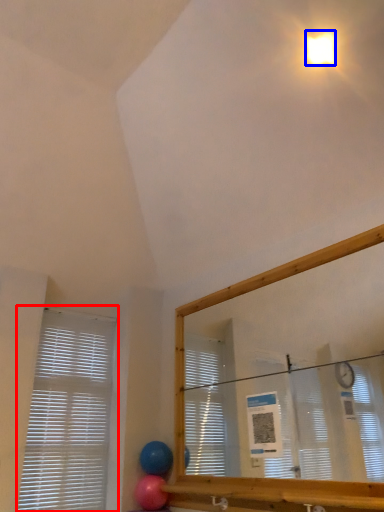
Question: Which object is closer to the camera taking this photo, window blind (highlighted by a red box) or light (highlighted by a blue box)?

Choices:
 (A) window blind
 (B) light

Answer: (B)